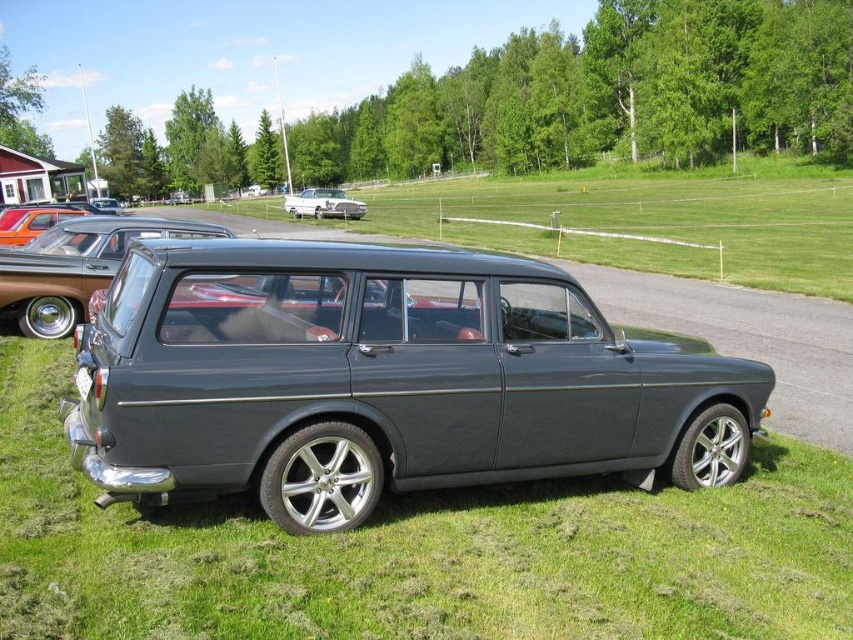
Question: Can you confirm if orange metallic car at left is positioned to the right of shiny silver sedan at center?

Choices:
 (A) yes
 (B) no

Answer: (A)

Question: Does orange metallic car at left appear over shiny silver sedan at center?

Choices:
 (A) no
 (B) yes

Answer: (A)

Question: Is metallic gray car at center smaller than orange metallic car at left?

Choices:
 (A) no
 (B) yes

Answer: (B)

Question: Which of these objects is positioned closest to the shiny silver sedan at center?

Choices:
 (A) white plastic license plate at lower center
 (B) satin dark gray station wagon at center
 (C) metallic gray car at center

Answer: (B)

Question: Which is nearer to the metallic gray car at center?

Choices:
 (A) shiny silver sedan at center
 (B) orange metallic car at left

Answer: (B)

Question: Based on their relative distances, which object is farther from the orange metallic car at left?

Choices:
 (A) shiny silver sedan at center
 (B) satin dark gray station wagon at center
 (C) metallic gray car at center
 (D) white plastic license plate at lower center

Answer: (A)